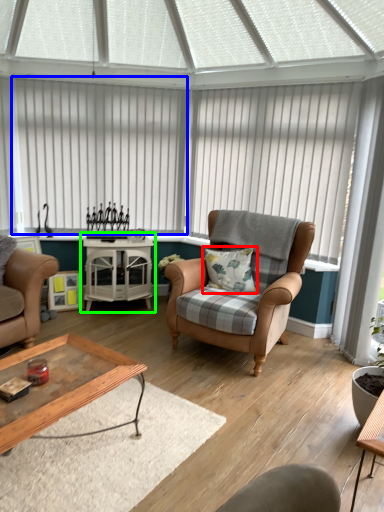
Question: Considering the real-world distances, which object is closest to pillow (highlighted by a red box)? blind (highlighted by a blue box) or table (highlighted by a green box).

Choices:
 (A) blind
 (B) table

Answer: (B)